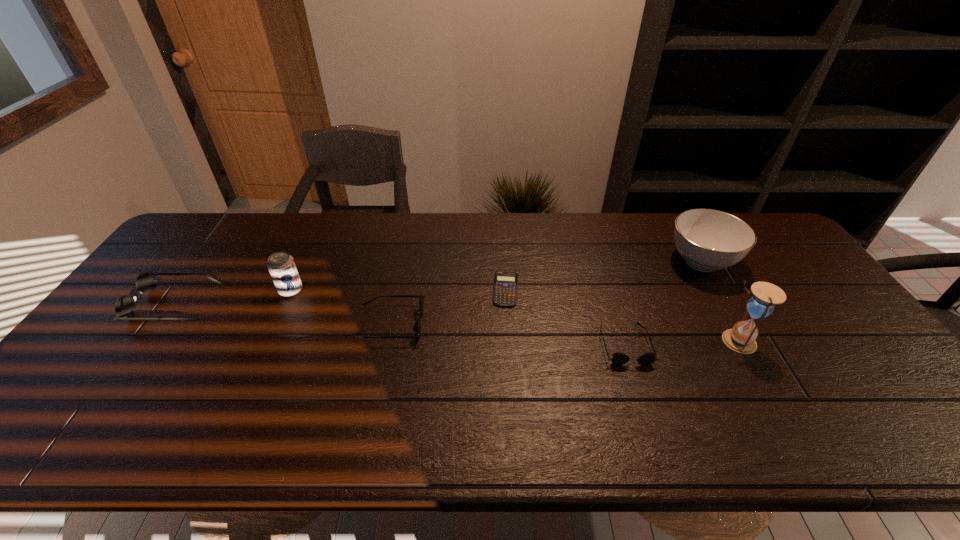
I want to click on hourglass, so click(741, 338).

The height and width of the screenshot is (540, 960). I want to click on vacant area situated on the front-facing side of the fifth tallest object, so click(544, 323).

Where is `vacant space located 0.110m on the front-facing side of the sixth tallest object`? Image resolution: width=960 pixels, height=540 pixels. vacant space located 0.110m on the front-facing side of the sixth tallest object is located at coordinates (644, 406).

Identify the location of free space located on the left of the beer can. (228, 291).

Where is `free location located 0.230m on the front of the chinaware`? Image resolution: width=960 pixels, height=540 pixels. free location located 0.230m on the front of the chinaware is located at coordinates (751, 347).

You are a GUI agent. You are given a task and a screenshot of the screen. Output one action in this format:
    pyautogui.click(x=<x>, y=<y>)
    Task: Click on the vacant region located 0.170m on the right of the calculator
    The image size is (960, 540).
    Given the screenshot: What is the action you would take?
    pyautogui.click(x=577, y=289)

Where is `vacant space situated 0.050m on the front of the tallest object`? Image resolution: width=960 pixels, height=540 pixels. vacant space situated 0.050m on the front of the tallest object is located at coordinates (753, 370).

Identify the location of object that is at the far edge. The image size is (960, 540). (708, 240).

Identify the location of object that is at the left edge. (124, 308).

The height and width of the screenshot is (540, 960). In the image, there is a desktop. In order to click on vacant space at the far edge in this screenshot , I will do (237, 228).